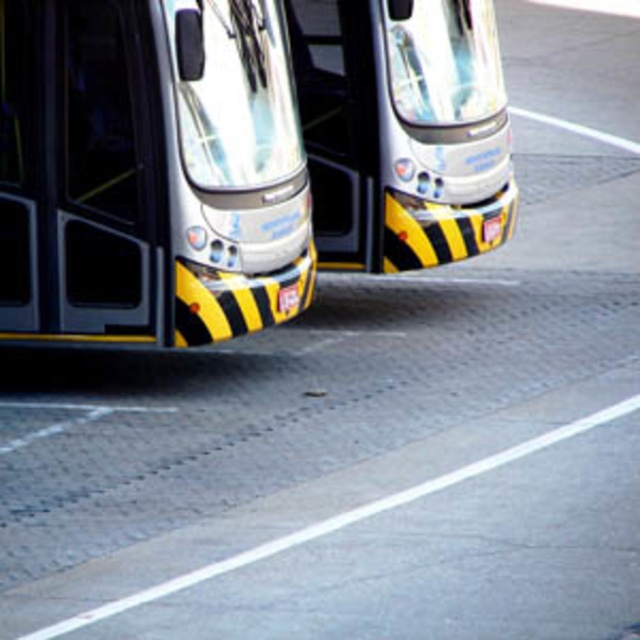
Question: Which object appears farthest from the camera in this image?

Choices:
 (A) yellow and black striped bumper at center
 (B) metallic silver bus at center

Answer: (B)

Question: Where is yellow and black striped bumper at center located in relation to metallic silver bus at center in the image?

Choices:
 (A) above
 (B) below

Answer: (B)

Question: Can you confirm if yellow and black striped bumper at center is bigger than metallic silver bus at center?

Choices:
 (A) yes
 (B) no

Answer: (A)

Question: In this image, where is yellow and black striped bumper at center located relative to metallic silver bus at center?

Choices:
 (A) above
 (B) below

Answer: (B)